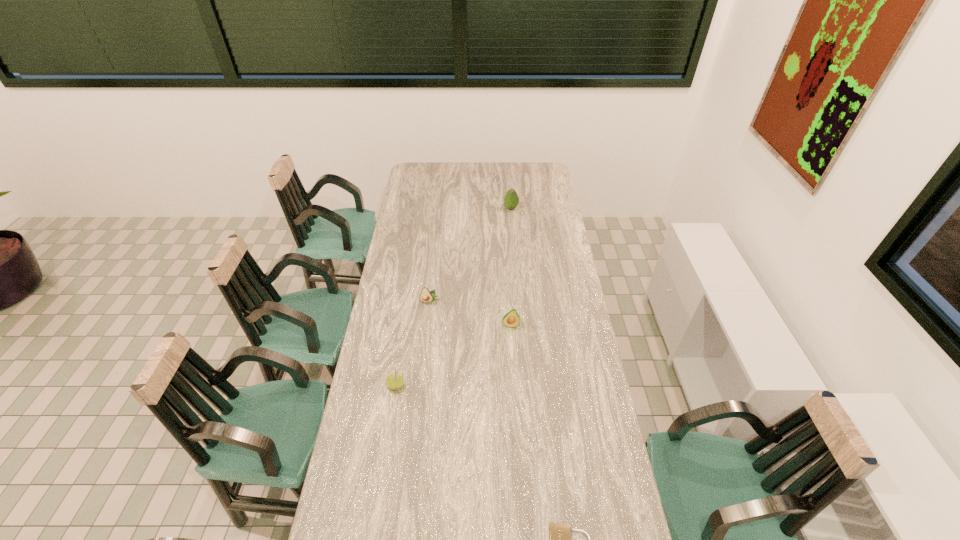
You are a GUI agent. You are given a task and a screenshot of the screen. Output one action in this format:
    pyautogui.click(x=<x>, y=<y>)
    Task: Click on the farthest avocado
    This screenshot has width=960, height=540.
    Given the screenshot: What is the action you would take?
    pyautogui.click(x=511, y=200)

You are a GUI agent. You are given a task and a screenshot of the screen. Output one action in this format:
    pyautogui.click(x=<x>, y=<y>)
    Task: Click on the nearest avocado
    This screenshot has width=960, height=540.
    Given the screenshot: What is the action you would take?
    pyautogui.click(x=511, y=319)

Identify the location of the leftmost object. Image resolution: width=960 pixels, height=540 pixels. (395, 381).

In order to click on pear in this screenshot , I will do pos(395,381).

Locate an element on the screen. The height and width of the screenshot is (540, 960). the fourth nearest object is located at coordinates (425, 296).

Locate an element on the screen. This screenshot has width=960, height=540. the leftmost avocado is located at coordinates (425, 296).

Find the location of a particular element. This screenshot has width=960, height=540. free space located on the back of the farthest object is located at coordinates (508, 174).

Identify the location of free region located 0.060m on the cut side of the nearest avocado. Image resolution: width=960 pixels, height=540 pixels. (512, 342).

This screenshot has width=960, height=540. In order to click on free space located on the right of the pear in this screenshot , I will do coord(513,386).

The height and width of the screenshot is (540, 960). What are the coordinates of `vacant space situated 0.300m on the seed side of the fourth nearest object` in the screenshot? It's located at (423, 367).